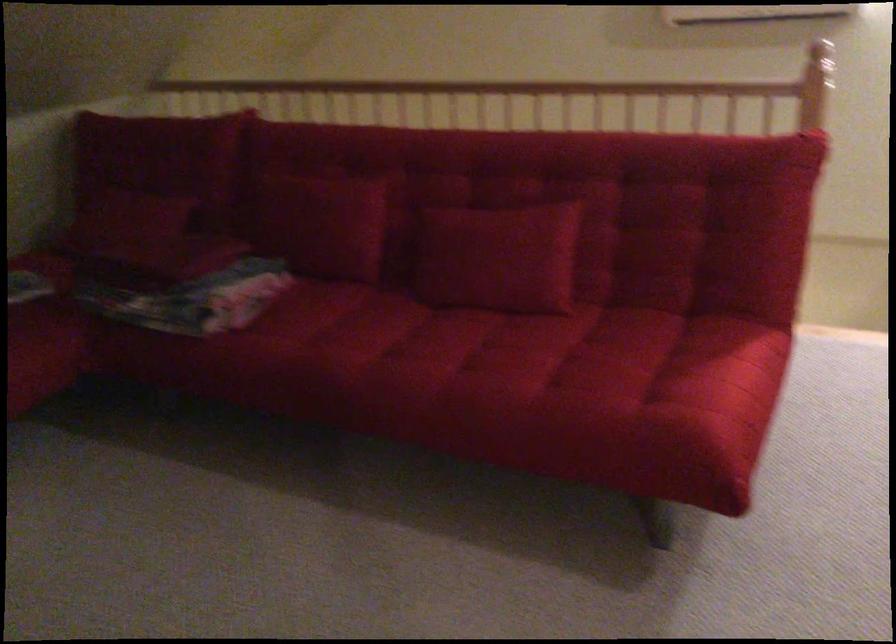
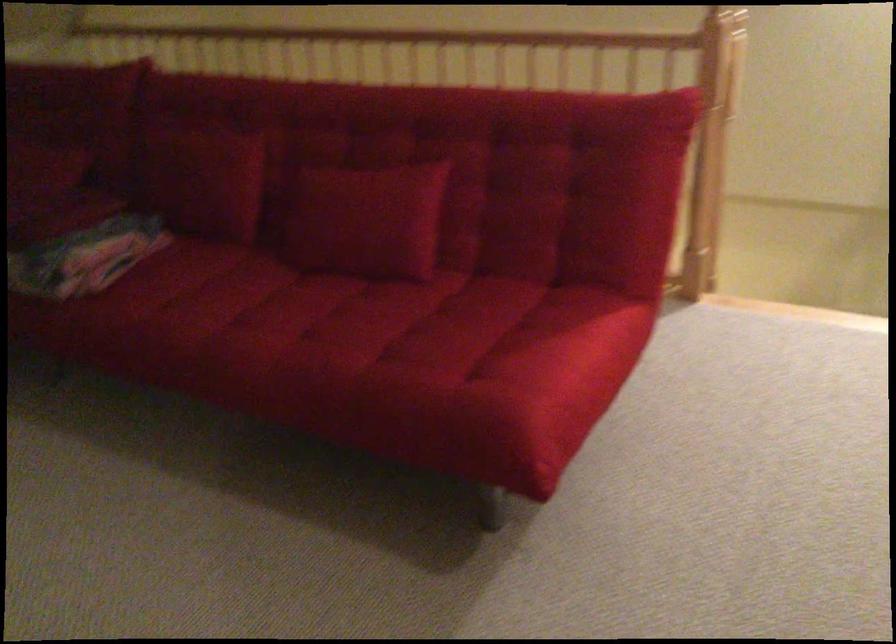
Find the pixel in the second image that matches [322,212] in the first image.

(202, 176)